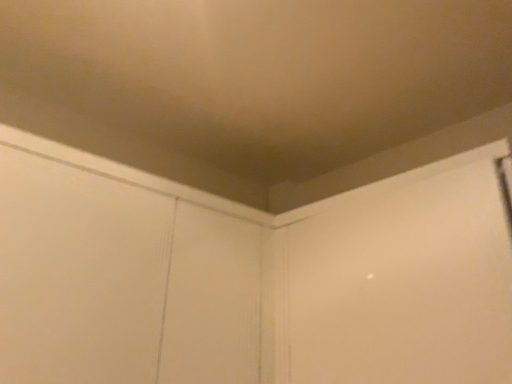
What is the approximate width of white matte screen door at center, which is the second screen door from left to right?

It is 14.01 inches.

Describe the element at coordinates (398, 281) in the screenshot. I see `white matte screen door at center, which is counted as the first screen door, starting from the right` at that location.

Identify the location of white matte screen door at center, which is the second screen door from left to right. (398, 281).

Identify the location of white wood screen door at upper center, placed as the second screen door when sorted from right to left. (121, 282).

This screenshot has width=512, height=384. What do you see at coordinates (121, 282) in the screenshot? I see `white wood screen door at upper center, placed as the second screen door when sorted from right to left` at bounding box center [121, 282].

Identify the location of white matte screen door at center, which is the second screen door from left to right. The height and width of the screenshot is (384, 512). (398, 281).

Is white matte screen door at center, which is the second screen door from left to right, to the left of white wood screen door at upper center, placed as the second screen door when sorted from right to left, from the viewer's perspective?

No.

Considering their positions, is white matte screen door at center, which is the second screen door from left to right, located in front of or behind white wood screen door at upper center, arranged as the first screen door when viewed from the left?

white matte screen door at center, which is the second screen door from left to right, is behind white wood screen door at upper center, arranged as the first screen door when viewed from the left.

Between point (279, 355) and point (3, 360), which one is positioned in front?

The point (3, 360) is more forward.

From the image's perspective, is white matte screen door at center, which is the second screen door from left to right, located above white wood screen door at upper center, placed as the second screen door when sorted from right to left?

Yes, from the image's perspective, white matte screen door at center, which is the second screen door from left to right, is on top of white wood screen door at upper center, placed as the second screen door when sorted from right to left.

From a real-world perspective, is white matte screen door at center, which is the second screen door from left to right, beneath white wood screen door at upper center, placed as the second screen door when sorted from right to left?

No.

Which object is thinner, white matte screen door at center, which is the second screen door from left to right, or white wood screen door at upper center, arranged as the first screen door when viewed from the left?

Thinner between the two is white matte screen door at center, which is the second screen door from left to right.

Does white matte screen door at center, which is the second screen door from left to right, have a lesser height compared to white wood screen door at upper center, arranged as the first screen door when viewed from the left?

Correct, white matte screen door at center, which is the second screen door from left to right, is not as tall as white wood screen door at upper center, arranged as the first screen door when viewed from the left.

Does white matte screen door at center, which is the second screen door from left to right, have a smaller size compared to white wood screen door at upper center, placed as the second screen door when sorted from right to left?

Indeed, white matte screen door at center, which is the second screen door from left to right, has a smaller size compared to white wood screen door at upper center, placed as the second screen door when sorted from right to left.

Can we say white matte screen door at center, which is the second screen door from left to right, lies outside white wood screen door at upper center, placed as the second screen door when sorted from right to left?

white matte screen door at center, which is the second screen door from left to right, lies outside white wood screen door at upper center, placed as the second screen door when sorted from right to left,'s area.

Is white matte screen door at center, which is the second screen door from left to right, not near white wood screen door at upper center, arranged as the first screen door when viewed from the left?

Actually, white matte screen door at center, which is the second screen door from left to right, and white wood screen door at upper center, arranged as the first screen door when viewed from the left, are a little close together.

Does white matte screen door at center, which is the second screen door from left to right, turn towards white wood screen door at upper center, placed as the second screen door when sorted from right to left?

No, white matte screen door at center, which is the second screen door from left to right, is not aimed at white wood screen door at upper center, placed as the second screen door when sorted from right to left.

You are a GUI agent. You are given a task and a screenshot of the screen. Output one action in this format:
    pyautogui.click(x=<x>, y=<y>)
    Task: Click on the screen door located on the right of white wood screen door at upper center, placed as the second screen door when sorted from right to left
    This screenshot has width=512, height=384.
    Given the screenshot: What is the action you would take?
    pyautogui.click(x=398, y=281)

Which object is positioned more to the right, white wood screen door at upper center, placed as the second screen door when sorted from right to left, or white matte screen door at center, which is the second screen door from left to right?

white matte screen door at center, which is the second screen door from left to right.

Is white wood screen door at upper center, placed as the second screen door when sorted from right to left, positioned behind white matte screen door at center, which is counted as the first screen door, starting from the right?

No, it is in front of white matte screen door at center, which is counted as the first screen door, starting from the right.

Between point (84, 289) and point (316, 314), which one is positioned in front?

The point (84, 289) is closer to the camera.

From the image's perspective, who appears lower, white wood screen door at upper center, placed as the second screen door when sorted from right to left, or white matte screen door at center, which is the second screen door from left to right?

white wood screen door at upper center, placed as the second screen door when sorted from right to left, appears lower in the image.

From a real-world perspective, which is physically above, white wood screen door at upper center, placed as the second screen door when sorted from right to left, or white matte screen door at center, which is the second screen door from left to right?

In real-world perspective, white matte screen door at center, which is the second screen door from left to right, is above.

Does white wood screen door at upper center, arranged as the first screen door when viewed from the left, have a lesser width compared to white matte screen door at center, which is counted as the first screen door, starting from the right?

In fact, white wood screen door at upper center, arranged as the first screen door when viewed from the left, might be wider than white matte screen door at center, which is counted as the first screen door, starting from the right.

Looking at this image, considering the sizes of objects white wood screen door at upper center, placed as the second screen door when sorted from right to left, and white matte screen door at center, which is counted as the first screen door, starting from the right, in the image provided, who is taller, white wood screen door at upper center, placed as the second screen door when sorted from right to left, or white matte screen door at center, which is counted as the first screen door, starting from the right,?

Standing taller between the two is white wood screen door at upper center, placed as the second screen door when sorted from right to left.

In the scene shown: Which of these two, white wood screen door at upper center, placed as the second screen door when sorted from right to left, or white matte screen door at center, which is counted as the first screen door, starting from the right, is smaller?

With smaller size is white matte screen door at center, which is counted as the first screen door, starting from the right.

Consider the image. Is white wood screen door at upper center, arranged as the first screen door when viewed from the left, inside the boundaries of white matte screen door at center, which is counted as the first screen door, starting from the right, or outside?

white wood screen door at upper center, arranged as the first screen door when viewed from the left, is not enclosed by white matte screen door at center, which is counted as the first screen door, starting from the right.

Are white wood screen door at upper center, arranged as the first screen door when viewed from the left, and white matte screen door at center, which is the second screen door from left to right, located far from each other?

No, white wood screen door at upper center, arranged as the first screen door when viewed from the left, is not far from white matte screen door at center, which is the second screen door from left to right.

Is white wood screen door at upper center, arranged as the first screen door when viewed from the left, turned away from white matte screen door at center, which is the second screen door from left to right?

white wood screen door at upper center, arranged as the first screen door when viewed from the left, is not turned away from white matte screen door at center, which is the second screen door from left to right.

Locate an element on the screen. The image size is (512, 384). screen door behind the white wood screen door at upper center, arranged as the first screen door when viewed from the left is located at coordinates (398, 281).

The width and height of the screenshot is (512, 384). I want to click on screen door above the white wood screen door at upper center, arranged as the first screen door when viewed from the left (from the image's perspective), so click(x=398, y=281).

There is a white wood screen door at upper center, arranged as the first screen door when viewed from the left. Where is `screen door above it (from a real-world perspective)`? Image resolution: width=512 pixels, height=384 pixels. screen door above it (from a real-world perspective) is located at coordinates (398, 281).